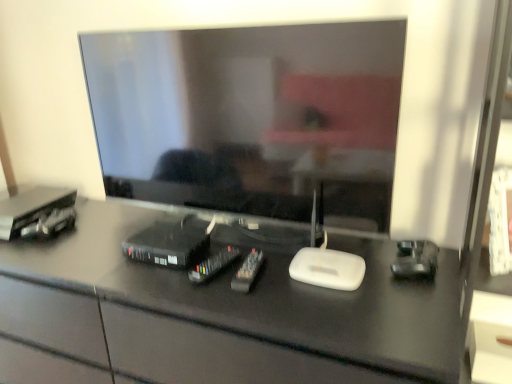
You are a GUI agent. You are given a task and a screenshot of the screen. Output one action in this format:
    pyautogui.click(x=<x>, y=<y>)
    Task: Click on the empty space that is to the right of black plastic remote controls at center, the 1th equipment when ordered from right to left
    The height and width of the screenshot is (384, 512).
    Given the screenshot: What is the action you would take?
    pyautogui.click(x=317, y=286)